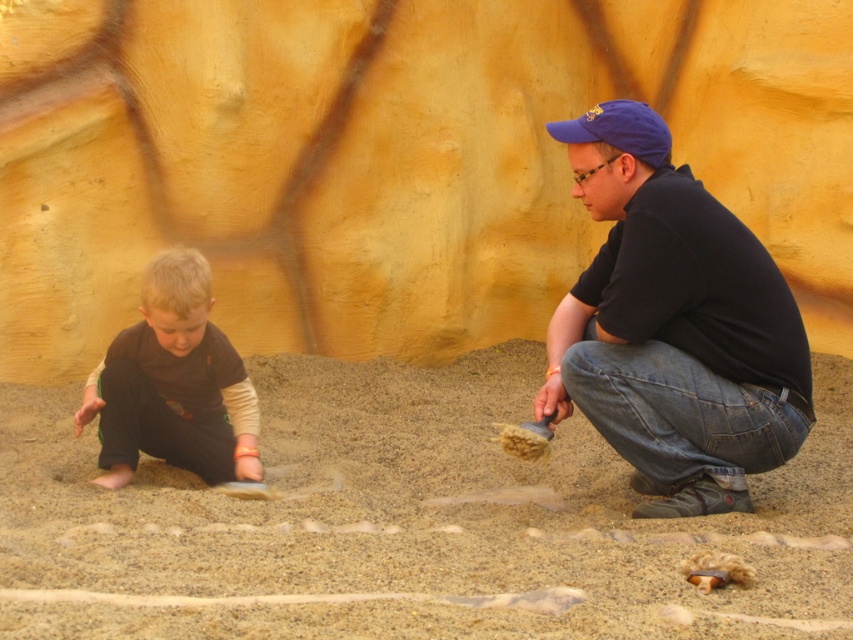
Question: Which of the following is the farthest from the observer?

Choices:
 (A) (666, 573)
 (B) (155, 412)

Answer: (B)

Question: Is fine-grained sand at center above blue fabric baseball cap at upper right?

Choices:
 (A) no
 (B) yes

Answer: (A)

Question: Based on their relative distances, which object is farther from the fine-grained sand at center?

Choices:
 (A) dark brown fabric pants at lower left
 (B) blue fabric baseball cap at upper right

Answer: (B)

Question: Does fine-grained sand at center appear under blue fabric baseball cap at upper right?

Choices:
 (A) yes
 (B) no

Answer: (A)

Question: Which point is farther from the camera taking this photo?

Choices:
 (A) (292, 561)
 (B) (161, 320)
 (C) (773, 428)
 (D) (575, 120)

Answer: (B)

Question: Does fine-grained sand at center appear on the left side of blue fabric baseball cap at upper right?

Choices:
 (A) no
 (B) yes

Answer: (B)